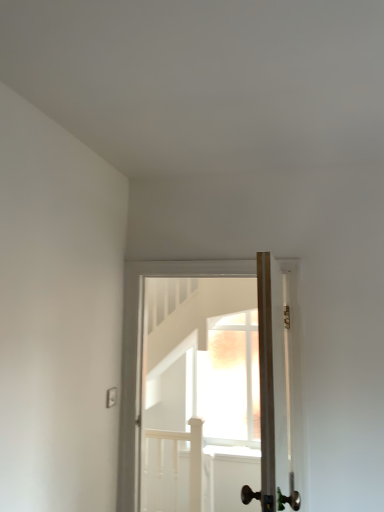
Question: In which direction should I rotate to look at wooden door at center, which is counted as the second door, starting from the back?

Choices:
 (A) left
 (B) right

Answer: (B)

Question: Is wooden door at center, which ranks as the 1th door in front-to-back order, at the left side of wooden door at center, positioned as the second door in front-to-back order?

Choices:
 (A) yes
 (B) no

Answer: (B)

Question: Could you tell me if wooden door at center, which ranks as the 1th door in front-to-back order, is facing wooden door at center, positioned as the second door in front-to-back order?

Choices:
 (A) no
 (B) yes

Answer: (B)

Question: Does wooden door at center, which is counted as the second door, starting from the back, appear on the right side of wooden door at center, positioned as the second door in front-to-back order?

Choices:
 (A) yes
 (B) no

Answer: (A)

Question: Can you confirm if wooden door at center, which is counted as the second door, starting from the back, is taller than wooden door at center, positioned as the second door in front-to-back order?

Choices:
 (A) no
 (B) yes

Answer: (A)

Question: Is wooden door at center, which is the first door from back to front, at the back of wooden door at center, which ranks as the 1th door in front-to-back order?

Choices:
 (A) yes
 (B) no

Answer: (B)

Question: Does wooden door at center, which is counted as the second door, starting from the back, touch wooden door at center, positioned as the second door in front-to-back order?

Choices:
 (A) no
 (B) yes

Answer: (A)

Question: Considering the relative sizes of wooden door at center, which is the first door from back to front, and wooden door at center, which is counted as the second door, starting from the back, in the image provided, is wooden door at center, which is the first door from back to front, smaller than wooden door at center, which is counted as the second door, starting from the back,?

Choices:
 (A) yes
 (B) no

Answer: (B)

Question: Considering the relative sizes of wooden door at center, which is the first door from back to front, and wooden door at center, which ranks as the 1th door in front-to-back order, in the image provided, is wooden door at center, which is the first door from back to front, wider than wooden door at center, which ranks as the 1th door in front-to-back order,?

Choices:
 (A) no
 (B) yes

Answer: (B)

Question: From the image's perspective, does wooden door at center, which is the first door from back to front, appear lower than wooden door at center, which ranks as the 1th door in front-to-back order?

Choices:
 (A) no
 (B) yes

Answer: (B)

Question: Could you tell me if wooden door at center, which is the first door from back to front, is turned towards wooden door at center, which ranks as the 1th door in front-to-back order?

Choices:
 (A) yes
 (B) no

Answer: (A)

Question: Is wooden door at center, which is the first door from back to front, next to wooden door at center, which is counted as the second door, starting from the back?

Choices:
 (A) no
 (B) yes

Answer: (A)

Question: Does wooden door at center, which is the first door from back to front, appear on the left side of wooden door at center, which ranks as the 1th door in front-to-back order?

Choices:
 (A) no
 (B) yes

Answer: (B)

Question: From the image's perspective, is wooden door at center, positioned as the second door in front-to-back order, located above or below wooden door at center, which ranks as the 1th door in front-to-back order?

Choices:
 (A) above
 (B) below

Answer: (B)